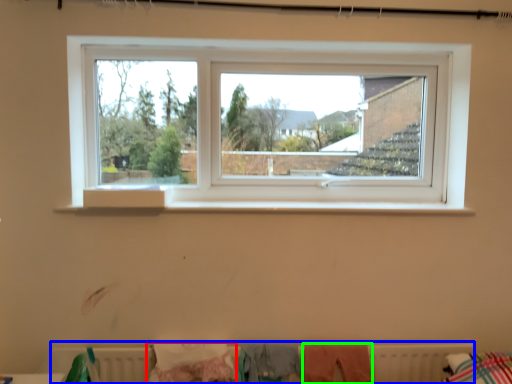
Question: Considering the real-world distances, which object is farthest from clothing (highlighted by a red box)? radiator (highlighted by a blue box) or clothing (highlighted by a green box)?

Choices:
 (A) radiator
 (B) clothing

Answer: (B)